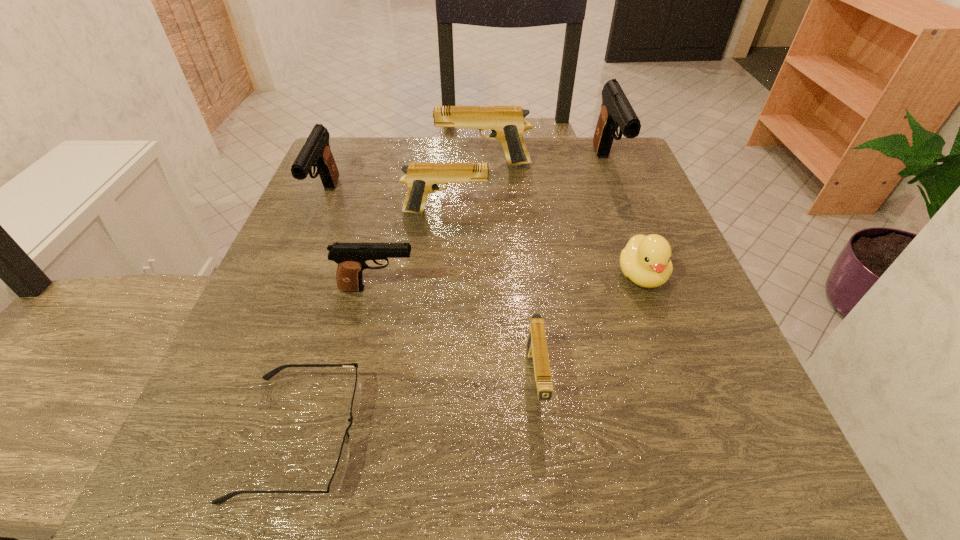
The width and height of the screenshot is (960, 540). Find the location of `the shortest pistol`. the shortest pistol is located at coordinates (537, 351).

Identify the location of black spectacles. (337, 478).

Find the location of a particular element. the shortest object is located at coordinates (337, 478).

This screenshot has width=960, height=540. In order to click on blank area located 0.080m at the barrel of the rightmost pistol in this screenshot , I will do `click(626, 216)`.

In order to click on free space located at the barrel of the farthest tan pistol in this screenshot , I will do `click(362, 164)`.

This screenshot has height=540, width=960. What are the coordinates of `vacant space located 0.150m at the barrel of the farthest tan pistol` in the screenshot? It's located at (374, 164).

The width and height of the screenshot is (960, 540). I want to click on vacant space located at the barrel of the farthest tan pistol, so click(374, 164).

Find the location of `free location located at the barrel of the second smallest black pistol`. free location located at the barrel of the second smallest black pistol is located at coordinates (270, 330).

At what (x,y) coordinates should I click in order to perform the action: click on free location located 0.160m at the barrel of the second smallest tan pistol. Please return your answer as a coordinate pair (x, y). Image resolution: width=960 pixels, height=540 pixels. Looking at the image, I should click on (565, 212).

This screenshot has height=540, width=960. What are the coordinates of `blank space located 0.370m at the barrel of the smallest black pistol` in the screenshot? It's located at (629, 289).